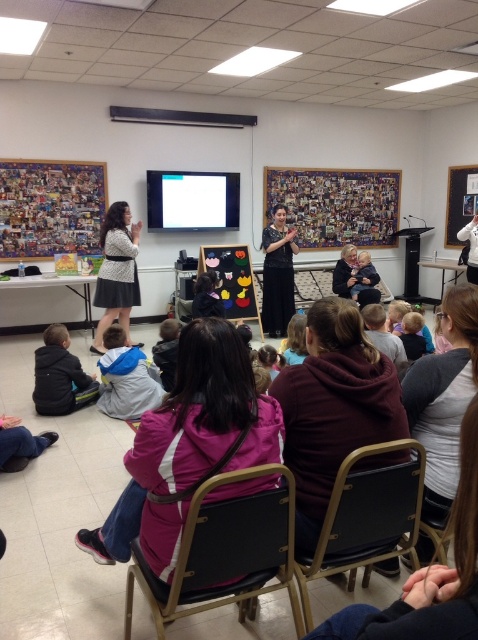
Question: Can you confirm if black fabric chair at lower center is smaller than black lace dress at center?

Choices:
 (A) no
 (B) yes

Answer: (B)

Question: Is matte black dress at left wider than black lace dress at center?

Choices:
 (A) yes
 (B) no

Answer: (A)

Question: Among these points, which one is nearest to the camera?

Choices:
 (A) (133, 230)
 (B) (337, 548)

Answer: (B)

Question: Which of the following is the farthest from the observer?

Choices:
 (A) matte black dress at left
 (B) black fabric chair at lower center

Answer: (A)

Question: Which point is closer to the camera taking this photo?

Choices:
 (A) (122, 225)
 (B) (281, 285)
 (C) (273, 554)
 (D) (393, 525)

Answer: (C)

Question: Is black fabric chair at lower center to the left of matte black dress at left from the viewer's perspective?

Choices:
 (A) no
 (B) yes

Answer: (A)